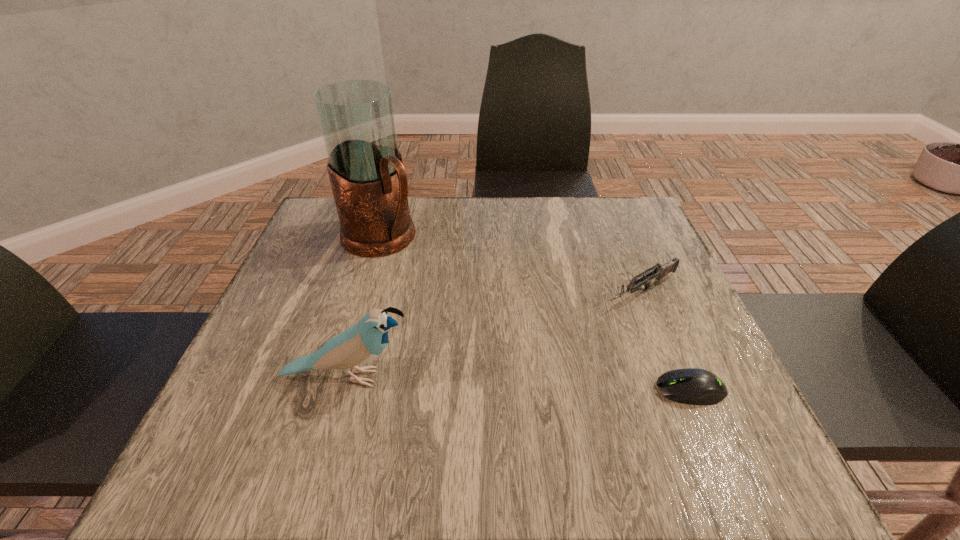
Identify the location of object that is the second closest to the bird. The width and height of the screenshot is (960, 540). 659,272.

The height and width of the screenshot is (540, 960). Identify the location of object that is the third closest to the gun. (369, 182).

The height and width of the screenshot is (540, 960). I want to click on free space that satisfies the following two spatial constraints: 1. on the front side of the farthest object; 2. at the face of the third shortest object, so click(341, 377).

Find the location of `vacant point that satisfies the following two spatial constraints: 1. on the front side of the bird; 2. at the face of the tallest object`. vacant point that satisfies the following two spatial constraints: 1. on the front side of the bird; 2. at the face of the tallest object is located at coordinates (341, 377).

Locate an element on the screen. The image size is (960, 540). vacant space that satisfies the following two spatial constraints: 1. on the front side of the pitcher; 2. on the right side of the third tallest object is located at coordinates (365, 293).

Find the location of a particular element. This screenshot has height=540, width=960. vacant point that satisfies the following two spatial constraints: 1. on the front side of the third nearest object; 2. on the wheel side of the shortest object is located at coordinates (681, 390).

What are the coordinates of `free space that satisfies the following two spatial constraints: 1. on the front side of the third shortest object; 2. at the face of the pitcher` in the screenshot? It's located at (341, 377).

The width and height of the screenshot is (960, 540). Identify the location of vacant area that satisfies the following two spatial constraints: 1. on the front side of the pitcher; 2. on the wheel side of the shortest object. (x=337, y=390).

The width and height of the screenshot is (960, 540). Identify the location of vacant space that satisfies the following two spatial constraints: 1. on the front side of the computer mouse; 2. on the wheel side of the third tallest object. click(x=681, y=390).

What are the coordinates of `free space that satisfies the following two spatial constraints: 1. on the front side of the tallest object; 2. on the right side of the second shortest object` in the screenshot? It's located at (365, 293).